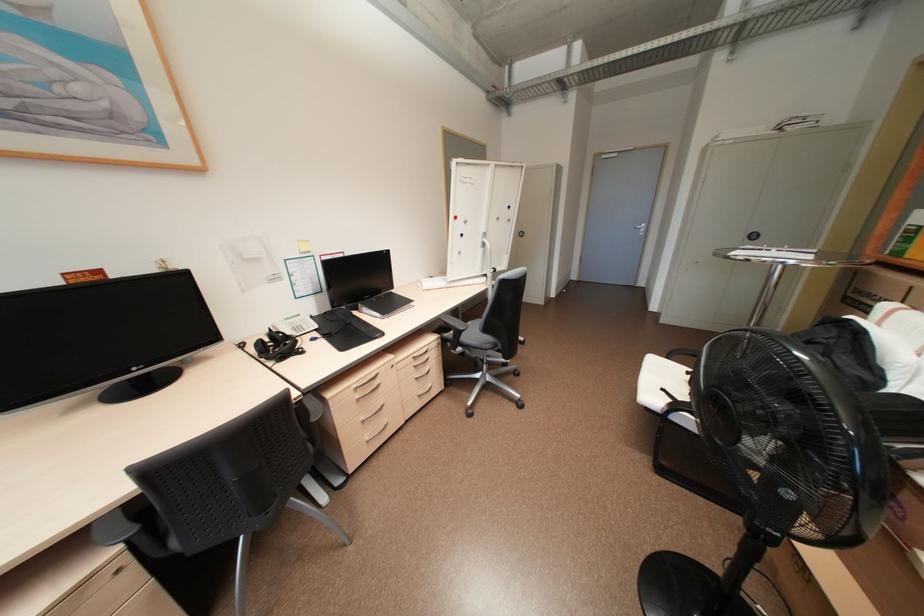
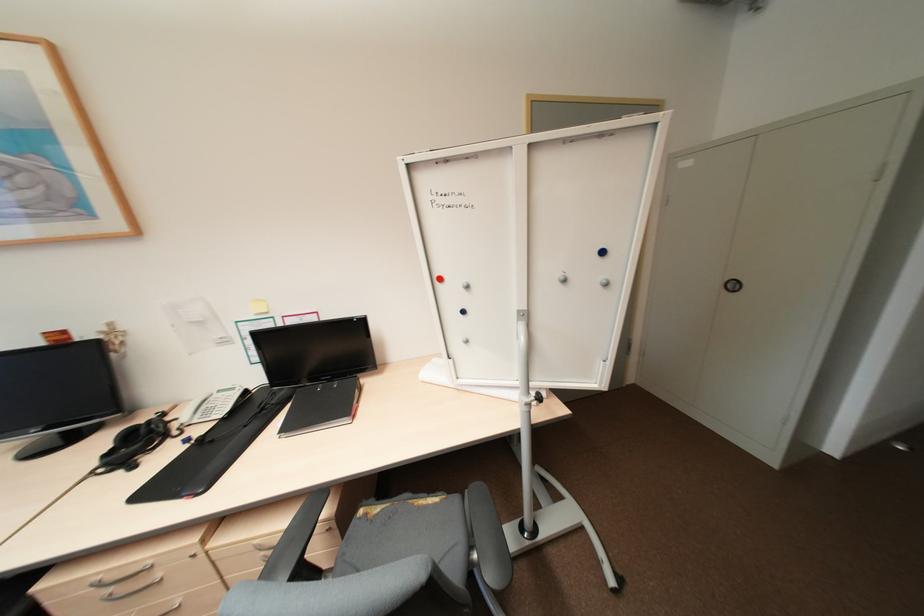
In the second image, find the point that corresponds to [284,347] in the first image.

(142, 444)